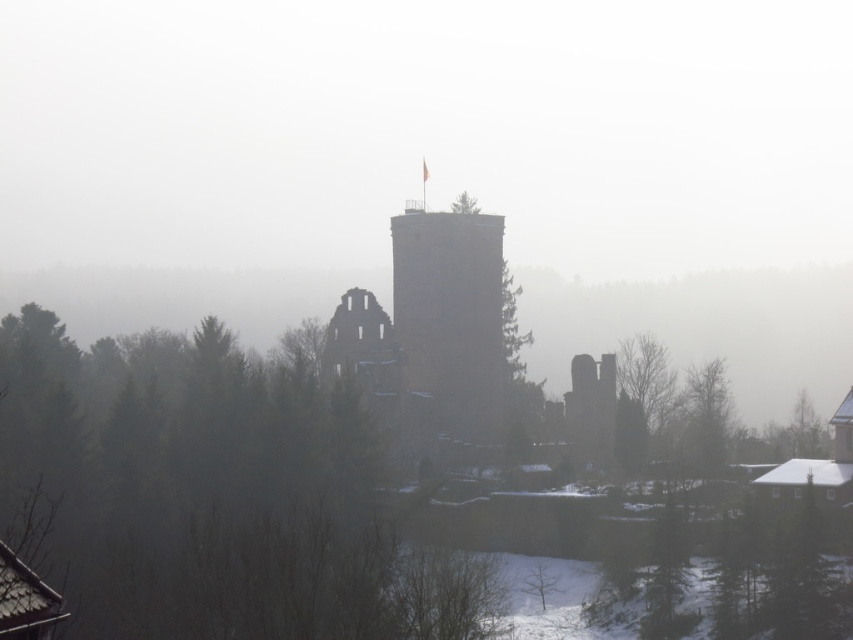
Question: Does brown stone tower at center have a larger size compared to green leafy tree at right?

Choices:
 (A) no
 (B) yes

Answer: (B)

Question: Is brown stone tower at center thinner than green leafy tree at right?

Choices:
 (A) yes
 (B) no

Answer: (B)

Question: Does brown stone tower at center have a greater width compared to green leafy tree at right?

Choices:
 (A) no
 (B) yes

Answer: (B)

Question: Which object is closer to the camera taking this photo?

Choices:
 (A) green leafy tree at right
 (B) brown stone tower at center

Answer: (A)

Question: Which object is closer to the camera taking this photo?

Choices:
 (A) green leafy tree at right
 (B) brown stone tower at center

Answer: (A)